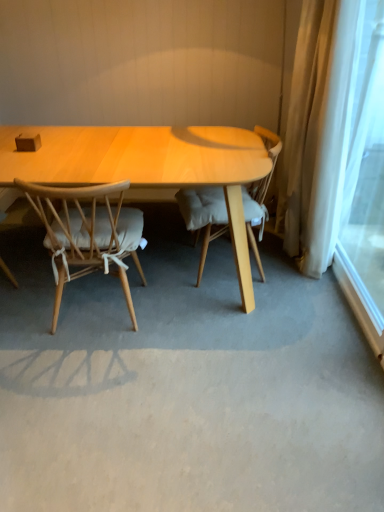
Image resolution: width=384 pixels, height=512 pixels. Find the location of `vacant area to the left of light wood chair with cushion at left, which is counted as the 1th chair, starting from the left`. vacant area to the left of light wood chair with cushion at left, which is counted as the 1th chair, starting from the left is located at coordinates (26, 301).